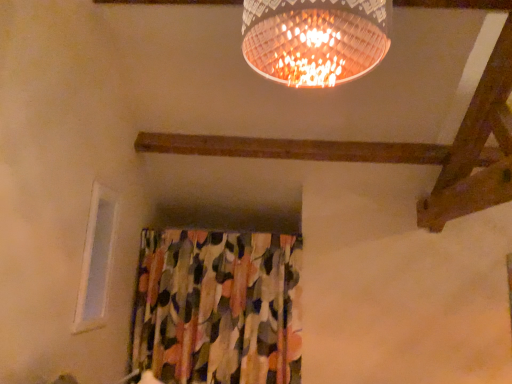
What do you see at coordinates (96, 260) in the screenshot?
I see `white plastic window at upper left` at bounding box center [96, 260].

Identify the location of white plastic window at upper left. (96, 260).

The width and height of the screenshot is (512, 384). In order to click on textured floral fabric at center in this screenshot , I will do `click(217, 307)`.

This screenshot has height=384, width=512. Describe the element at coordinates (217, 307) in the screenshot. I see `textured floral fabric at center` at that location.

Where is `white plastic window at upper left`? white plastic window at upper left is located at coordinates (96, 260).

Is white plastic window at upper left at the right side of textured floral fabric at center?

No, white plastic window at upper left is not to the right of textured floral fabric at center.

Is white plastic window at upper left further to camera compared to textured floral fabric at center?

No, it is in front of textured floral fabric at center.

Does point (97, 190) appear closer or farther from the camera than point (234, 347)?

Point (97, 190) is closer to the camera than point (234, 347).

From the image's perspective, is white plastic window at upper left under textured floral fabric at center?

No.

From a real-world perspective, which is physically above, white plastic window at upper left or textured floral fabric at center?

white plastic window at upper left, from a real-world perspective.

Can you confirm if white plastic window at upper left is wider than textured floral fabric at center?

No.

Considering the sizes of objects white plastic window at upper left and textured floral fabric at center in the image provided, who is shorter, white plastic window at upper left or textured floral fabric at center?

With less height is white plastic window at upper left.

Who is smaller, white plastic window at upper left or textured floral fabric at center?

white plastic window at upper left.

Choose the correct answer: Is white plastic window at upper left inside textured floral fabric at center or outside it?

white plastic window at upper left is not enclosed by textured floral fabric at center.

Based on the photo, is white plastic window at upper left not near textured floral fabric at center?

They are positioned close to each other.

Is white plastic window at upper left facing away from textured floral fabric at center?

No, white plastic window at upper left is not facing the opposite direction of textured floral fabric at center.

Measure the distance between white plastic window at upper left and textured floral fabric at center.

white plastic window at upper left and textured floral fabric at center are 30.49 inches apart.

In the image, there is a textured floral fabric at center. Where is `window above it (from the image's perspective)`? This screenshot has height=384, width=512. window above it (from the image's perspective) is located at coordinates (96, 260).

Does textured floral fabric at center appear on the left side of white plastic window at upper left?

No, textured floral fabric at center is not to the left of white plastic window at upper left.

Does textured floral fabric at center lie behind white plastic window at upper left?

Yes, textured floral fabric at center is behind white plastic window at upper left.

Is point (188, 286) closer to viewer compared to point (98, 236)?

No, (188, 286) is further to viewer.

From the image's perspective, is textured floral fabric at center positioned above or below white plastic window at upper left?

Based on their image positions, textured floral fabric at center is located beneath white plastic window at upper left.

From a real-world perspective, is textured floral fabric at center on white plastic window at upper left?

No, from a real-world perspective, textured floral fabric at center is not above white plastic window at upper left.

In the scene shown: Looking at their sizes, would you say textured floral fabric at center is wider or thinner than white plastic window at upper left?

In the image, textured floral fabric at center appears to be wider than white plastic window at upper left.

Can you confirm if textured floral fabric at center is taller than white plastic window at upper left?

Correct, textured floral fabric at center is much taller as white plastic window at upper left.

Who is smaller, textured floral fabric at center or white plastic window at upper left?

white plastic window at upper left.

Would you say textured floral fabric at center is outside white plastic window at upper left?

That's correct, textured floral fabric at center is outside of white plastic window at upper left.

Are textured floral fabric at center and white plastic window at upper left beside each other?

No.

Could you tell me if textured floral fabric at center is facing white plastic window at upper left?

Yes, textured floral fabric at center is turned towards white plastic window at upper left.

How different are the orientations of textured floral fabric at center and white plastic window at upper left in degrees?

There is a 86.5-degree angle between the facing directions of textured floral fabric at center and white plastic window at upper left.

Where is `window that is above the textured floral fabric at center (from the image's perspective)`? Image resolution: width=512 pixels, height=384 pixels. window that is above the textured floral fabric at center (from the image's perspective) is located at coordinates (96, 260).

Where is `window that appears on the left of textured floral fabric at center`? This screenshot has height=384, width=512. window that appears on the left of textured floral fabric at center is located at coordinates 96,260.

The image size is (512, 384). Identify the location of window above the textured floral fabric at center (from the image's perspective). (96, 260).